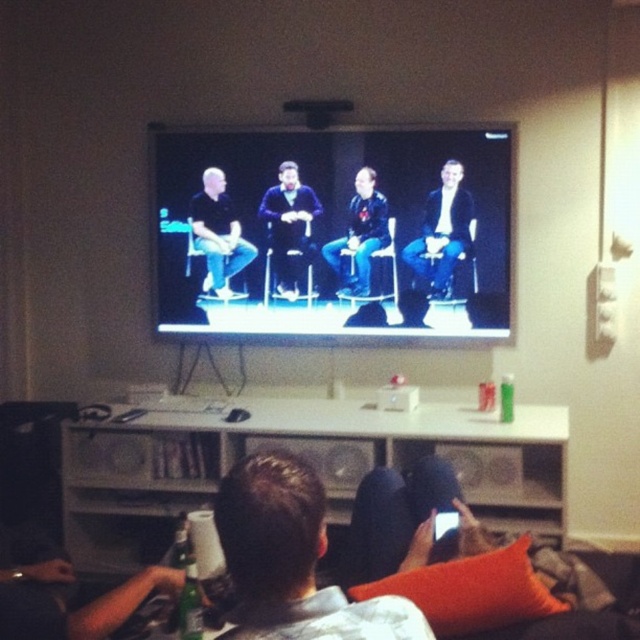
Is matte black chairs at center to the left of light blue suit at center from the viewer's perspective?

Yes, matte black chairs at center is to the left of light blue suit at center.

Between matte black chairs at center and light blue suit at center, which one appears on the right side from the viewer's perspective?

From the viewer's perspective, light blue suit at center appears more on the right side.

Who is more forward, (320, 164) or (445, 212)?

Point (445, 212)

Locate an element on the screen. matte black chairs at center is located at coordinates (332, 232).

Is the position of light blue suit at center less distant than that of black matte shirt at center?

Yes, light blue suit at center is in front of black matte shirt at center.

Find the location of `light blue suit at center`. light blue suit at center is located at coordinates (442, 232).

Locate an element on the screen. The width and height of the screenshot is (640, 640). light blue suit at center is located at coordinates (442, 232).

Can you confirm if dark blue sweater at center is smaller than black matte shirt at center?

Yes.

Is point (285, 275) positioned before point (198, 241)?

Yes, point (285, 275) is in front of point (198, 241).

This screenshot has width=640, height=640. In order to click on dark blue sweater at center in this screenshot , I will do `click(289, 227)`.